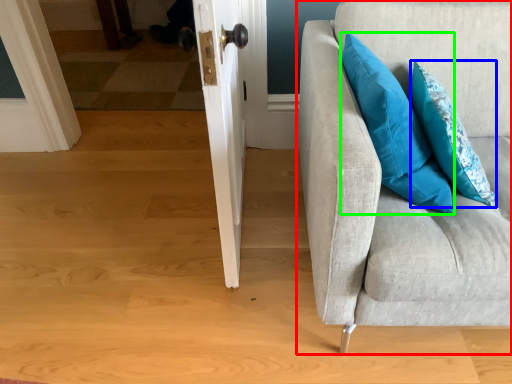
Question: Which object is the farthest from studio couch (highlighted by a red box)? Choose among these: pillow (highlighted by a blue box) or pillow (highlighted by a green box).

Choices:
 (A) pillow
 (B) pillow

Answer: (A)